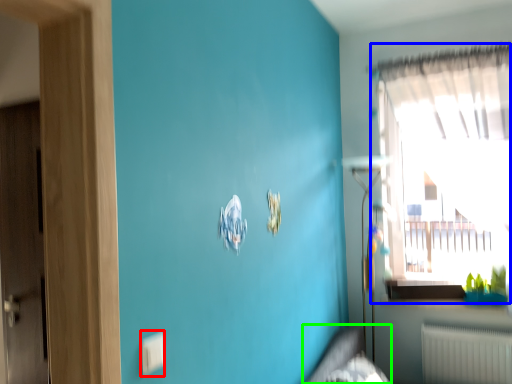
Question: Estimate the real-world distances between objects in this image. Which object is farther from electric outlet (highlighted by a red box), window (highlighted by a blue box) or bed frame (highlighted by a green box)?

Choices:
 (A) window
 (B) bed frame

Answer: (A)